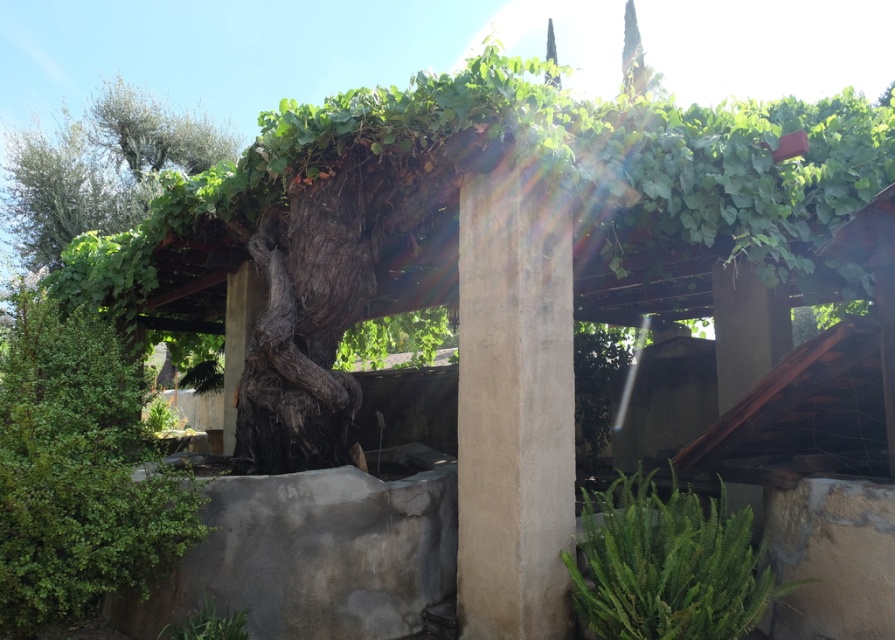
Question: Among these objects, which one is nearest to the camera?

Choices:
 (A) smooth concrete pillar at center
 (B) green leafy plant at lower right
 (C) green leafy tree at upper left

Answer: (B)

Question: Among these points, which one is farthest from the camera?

Choices:
 (A) (584, 540)
 (B) (521, 212)
 (C) (209, 148)

Answer: (C)

Question: Which is nearer to the green leafy plant at lower right?

Choices:
 (A) green leafy tree at upper left
 (B) smooth concrete pillar at center

Answer: (B)

Question: Is smooth concrete pillar at center positioned behind green leafy tree at upper left?

Choices:
 (A) yes
 (B) no

Answer: (B)

Question: Does green leafy plant at lower right appear over green leafy tree at upper left?

Choices:
 (A) yes
 (B) no

Answer: (B)

Question: Observing the image, what is the correct spatial positioning of smooth concrete pillar at center in reference to green leafy plant at lower right?

Choices:
 (A) right
 (B) left

Answer: (B)